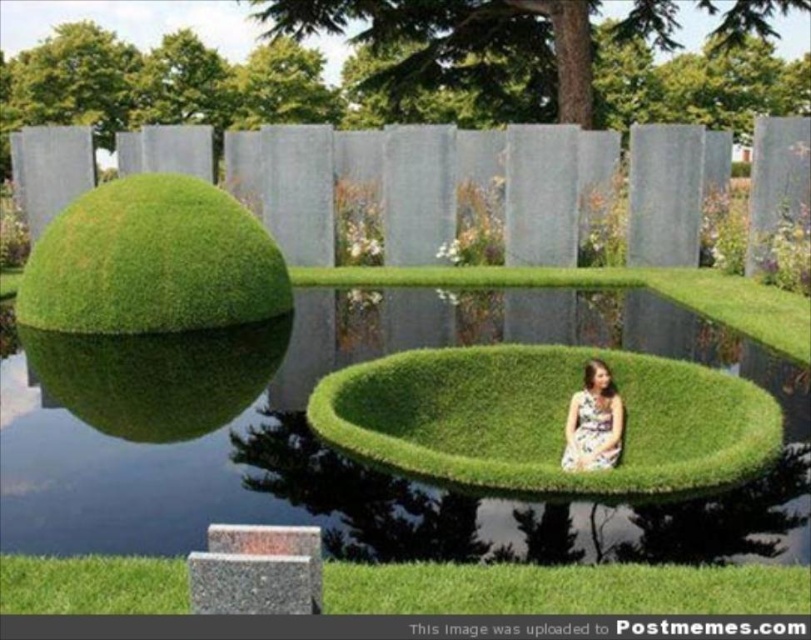
Question: Can you confirm if green grassy sphere at left is positioned below floral dress at center?

Choices:
 (A) yes
 (B) no

Answer: (B)

Question: Is green grassy sphere at left above floral dress at center?

Choices:
 (A) no
 (B) yes

Answer: (B)

Question: Estimate the real-world distances between objects in this image. Which object is farther from the floral dress at center?

Choices:
 (A) green grassy bowl at center
 (B) green grassy sphere at left

Answer: (B)

Question: Is green grassy sphere at left positioned in front of floral dress at center?

Choices:
 (A) no
 (B) yes

Answer: (A)

Question: Which object is positioned closest to the floral dress at center?

Choices:
 (A) green grassy bowl at center
 (B) green grassy sphere at left

Answer: (A)

Question: Which object is the farthest from the floral dress at center?

Choices:
 (A) green grassy bowl at center
 (B) green grassy sphere at left

Answer: (B)